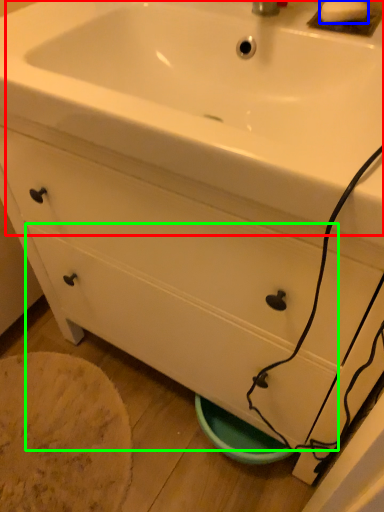
Question: Which is nearer to the sink (highlighted by a red box)? soap (highlighted by a blue box) or drawer (highlighted by a green box).

Choices:
 (A) soap
 (B) drawer

Answer: (A)